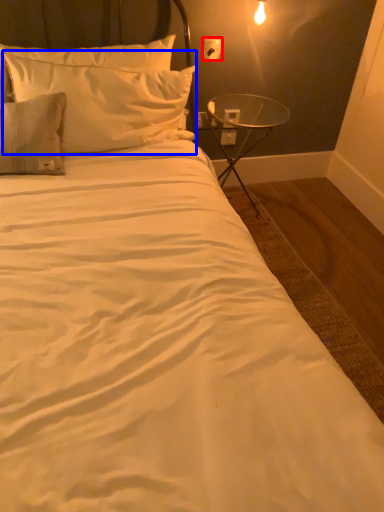
Question: Which object appears farthest to the camera in this image, electric outlet (highlighted by a red box) or pillow (highlighted by a blue box)?

Choices:
 (A) electric outlet
 (B) pillow

Answer: (A)